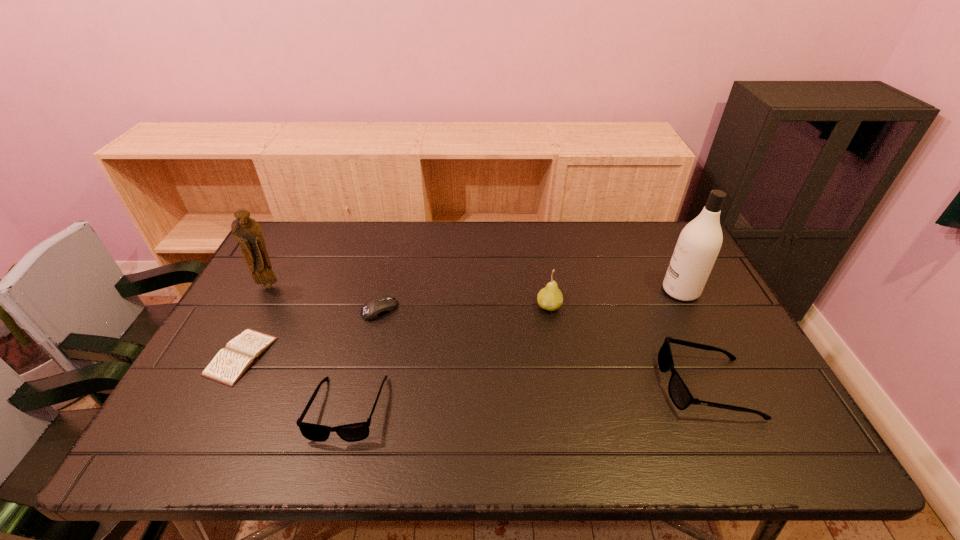
Where is `empty space between the shampoo and the figurine`? This screenshot has height=540, width=960. empty space between the shampoo and the figurine is located at coordinates (475, 288).

Find the location of `free space between the sixth tallest object and the third tallest object`. free space between the sixth tallest object and the third tallest object is located at coordinates (465, 308).

This screenshot has width=960, height=540. Identify the location of vacant point located between the second tallest object and the pear. (409, 296).

I want to click on vacant area between the computer equipment and the tallest object, so click(530, 300).

Identify which object is the closest to the third object from right to left. Please provide its 2D coordinates. Your answer should be formatted as a tuple, i.e. [(x, y)], where the tuple contains the x and y coordinates of a point satisfying the conditions above.

[(680, 395)]

Identify which object is located as the second nearest to the shampoo. Please provide its 2D coordinates. Your answer should be formatted as a tuple, i.e. [(x, y)], where the tuple contains the x and y coordinates of a point satisfying the conditions above.

[(550, 298)]

The height and width of the screenshot is (540, 960). Identify the location of free point that satisfies the following two spatial constraints: 1. on the front-facing side of the sixth tallest object; 2. on the right side of the figurine. coord(256,309).

Identify the location of free space that satisfies the following two spatial constraints: 1. on the front-facing side of the sixth shortest object; 2. on the left side of the shortest object. The height and width of the screenshot is (540, 960). (231, 356).

The width and height of the screenshot is (960, 540). What are the coordinates of `free location that satisfies the following two spatial constraints: 1. on the front-facing side of the tallest object; 2. on the front-facing side of the shorter sunglasses` in the screenshot? It's located at (740, 409).